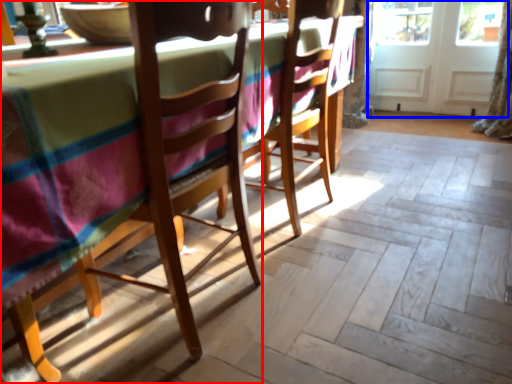
Question: Which object is closer to the camera taking this photo, chair (highlighted by a red box) or screen door (highlighted by a blue box)?

Choices:
 (A) chair
 (B) screen door

Answer: (A)